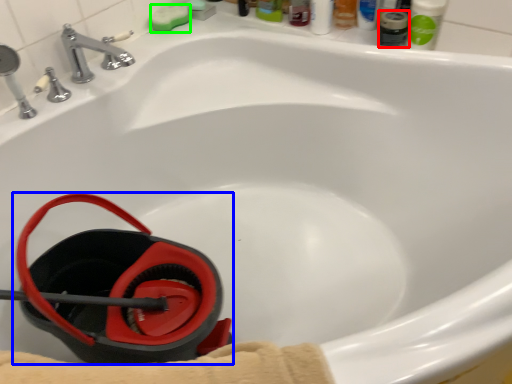
Question: Estimate the real-world distances between objects in this image. Which object is closer to mouthwash (highlighted by a red box), job (highlighted by a blue box) or soap (highlighted by a green box)?

Choices:
 (A) job
 (B) soap

Answer: (B)